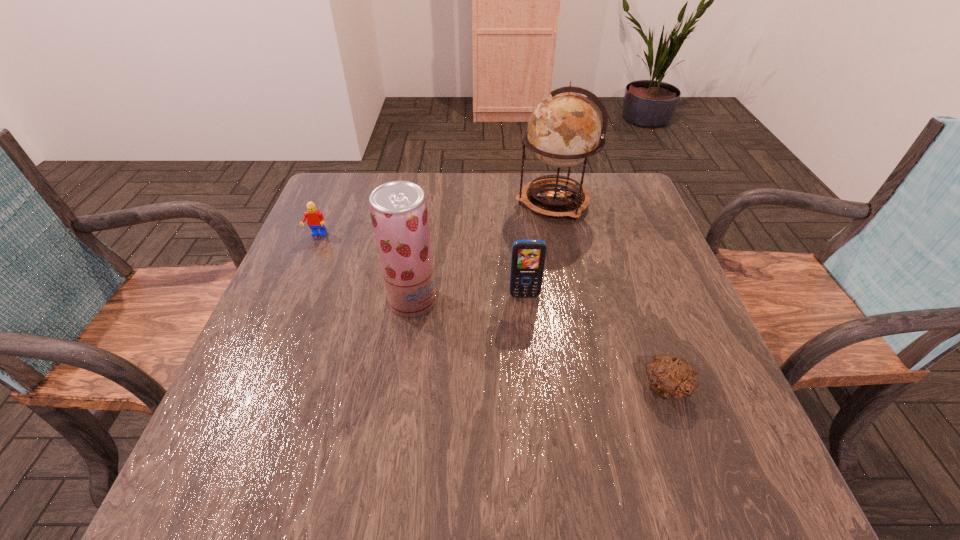
Identify the location of free space that satisfies the following two spatial constraints: 1. on the front-facing side of the second farthest object; 2. on the right side of the nearest object. The width and height of the screenshot is (960, 540). (252, 388).

This screenshot has width=960, height=540. I want to click on vacant space that satisfies the following two spatial constraints: 1. at the center of the globe; 2. on the front-facing side of the leftmost object, so click(x=560, y=235).